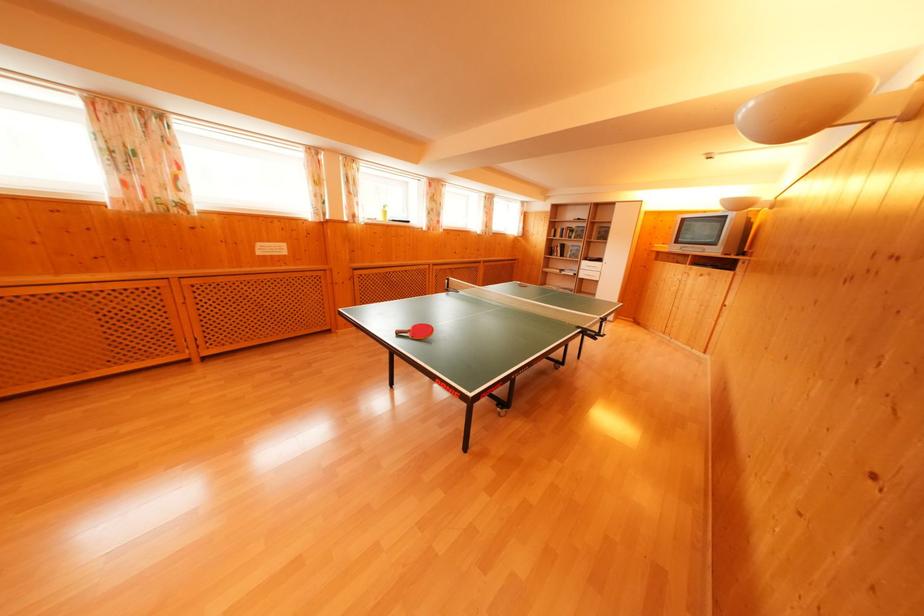
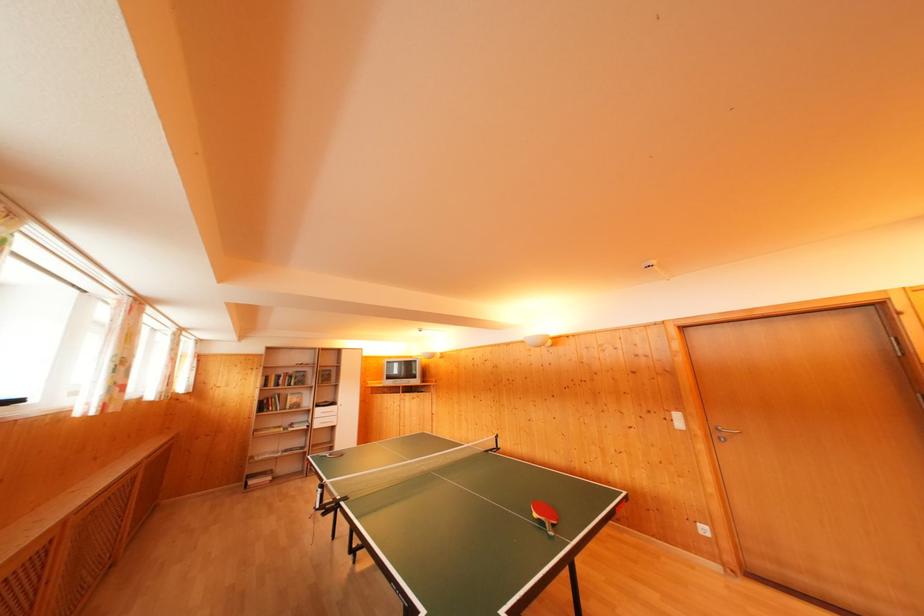
Find the pixel in the second image that matches point (578, 231) in the first image.

(296, 376)